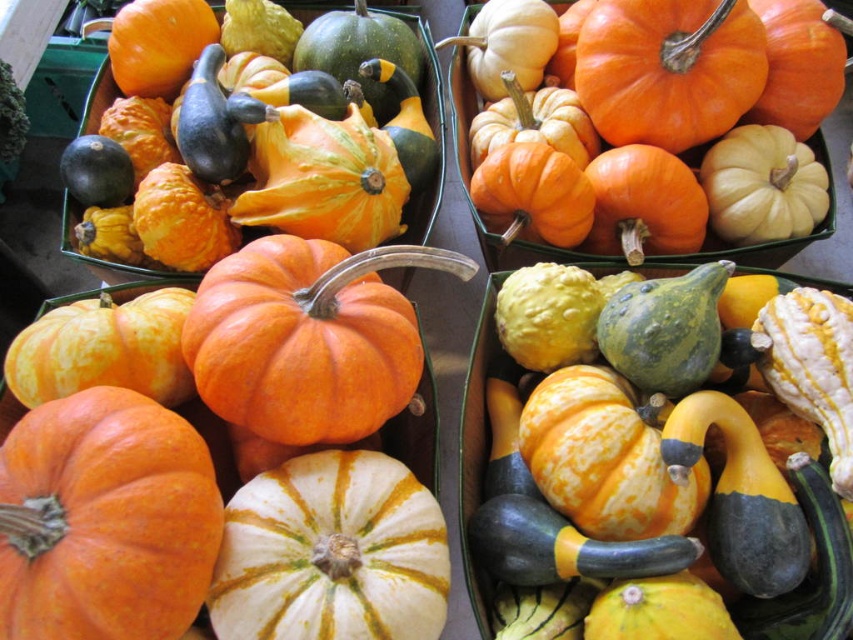
You are standing in the market and see the orange matte pumpkin at lower left and the orange matte pumpkin at upper right. Which pumpkin is closer to you?

The orange matte pumpkin at lower left is closer to you because it is in front of the orange matte pumpkin at upper right.

You are standing at the point marked as point (54, 417) in the pumpkin display. If you want to pick up a pumpkin from the foreground, which direction should you move to reach the foreground?

Since the point (54, 417) is already in the foreground where the large orange pumpkins are located, you are already at the foreground and don need to move further.

You are setting up a Halloween display and need to arrange the orange matte pumpkin at lower left and the white matte pumpkin at center. According to the image, which pumpkin should be placed to the left of the other?

The orange matte pumpkin at lower left should be placed to the left of the white matte pumpkin at center because the orange matte pumpkin at lower left is positioned on the left side of white matte pumpkin at center in the image.